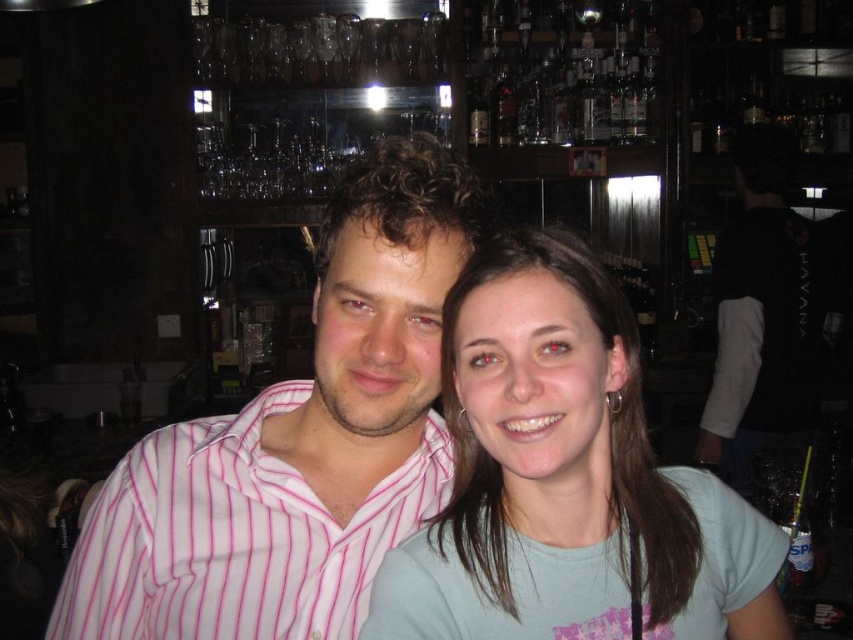
You are a photographer adjusting your camera to focus on the light blue cotton shirt at center and the pink striped shirt at left. Which shirt should you focus on first to ensure proper depth of field?

The light blue cotton shirt at center is closer to the viewer than the pink striped shirt at left, so you should focus on the light blue cotton shirt at center first to ensure proper depth of field.

You are standing at the entrance of the bar and want to find the pink striped shirt at center. According to the coordinates provided, in which direction should you look to locate it?

The pink striped shirt at center is located at coordinates point (297, 442), so you should look to the lower right direction to locate it.

You are a photographer standing at the back of the bar. You want to take a clear photo of the light blue cotton shirt at center without the pink striped shirt at center blocking it. What should you do?

The light blue cotton shirt at center is behind the pink striped shirt at center. To take a clear photo of the light blue cotton shirt at center without obstruction, you should move the pink striped shirt at center out of the way or adjust your angle to avoid it.